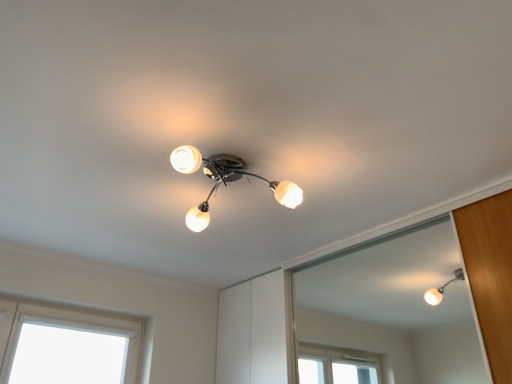
The image size is (512, 384). What do you see at coordinates (252, 332) in the screenshot?
I see `transparent glass door at center` at bounding box center [252, 332].

Find the location of a particular element. Image resolution: width=512 pixels, height=384 pixels. transparent glass door at center is located at coordinates (252, 332).

Find the location of a particular element. The image size is (512, 384). transparent glass door at center is located at coordinates [x=252, y=332].